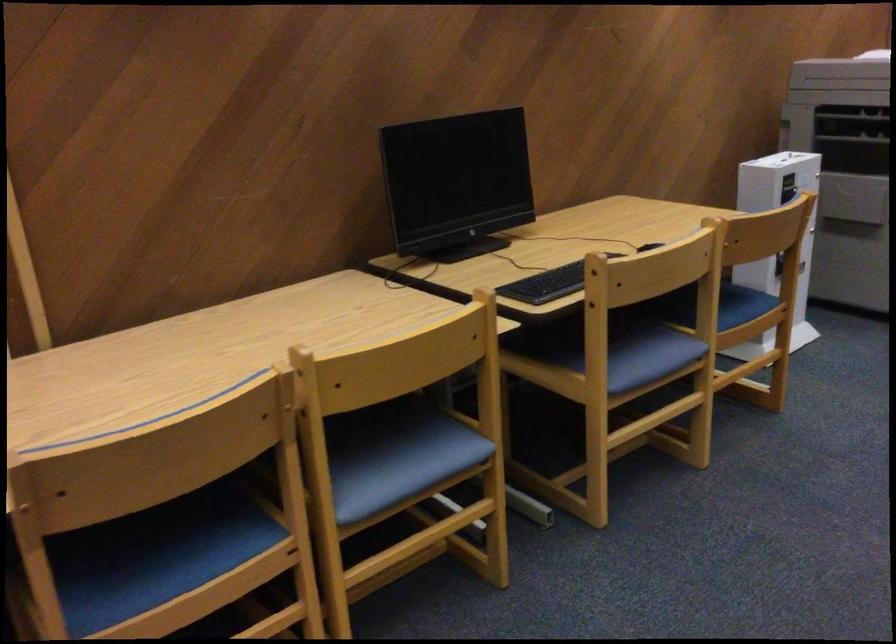
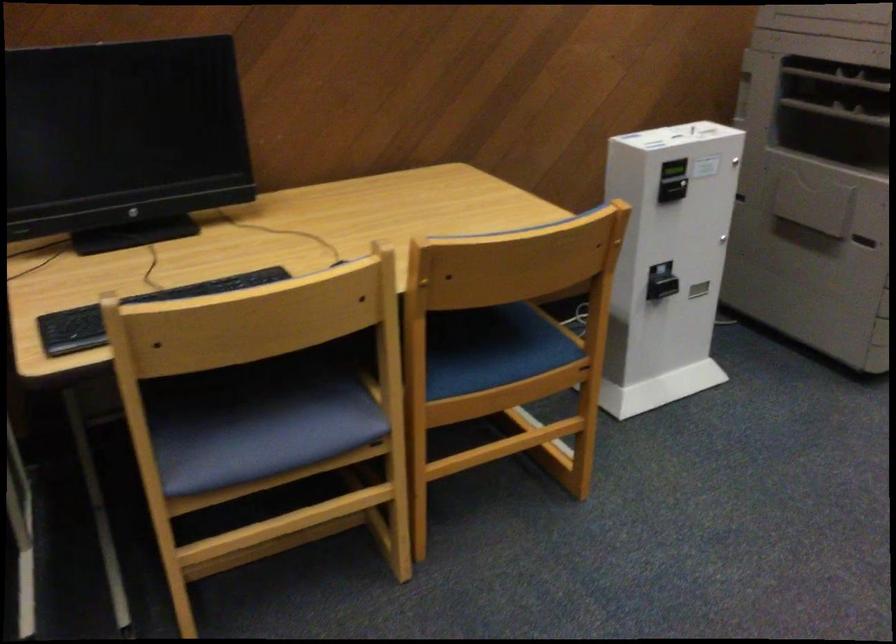
In the second image, find the point that corresponds to (618,353) in the first image.

(255, 422)